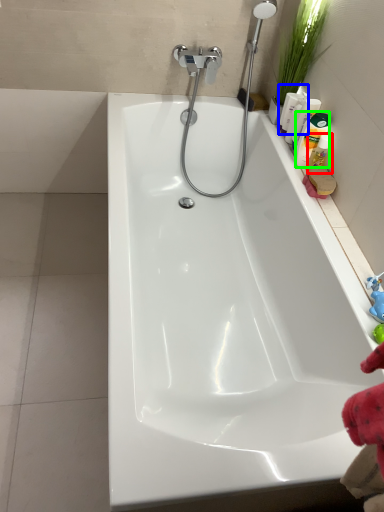
Question: Which object is positioned closest to cleaning product (highlighted by a red box)? Select from cleaning product (highlighted by a blue box) and cleaning product (highlighted by a green box).

Choices:
 (A) cleaning product
 (B) cleaning product

Answer: (B)